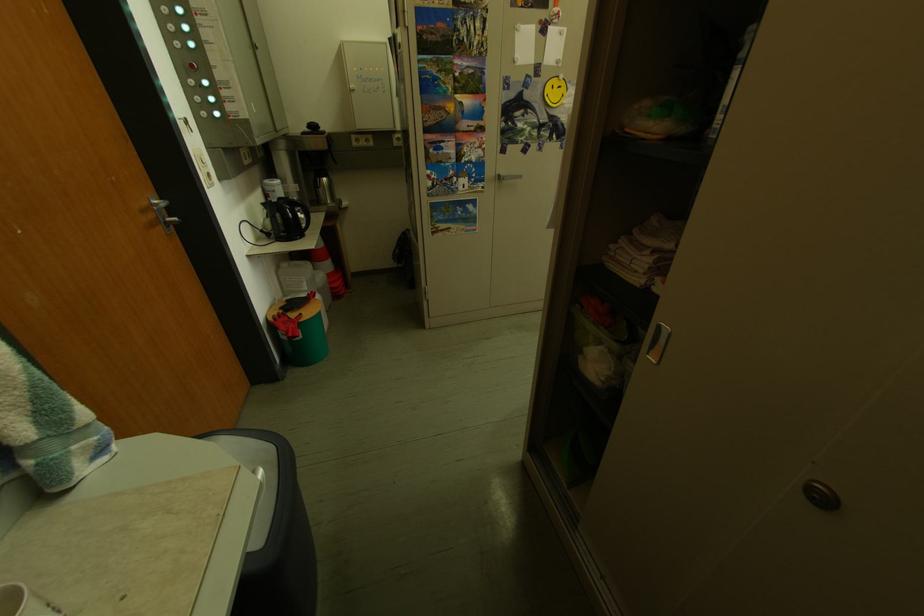
Find where to pull the recessed cabinet handle. Please return your answer as a coordinate pair (x, y).

(658, 342)